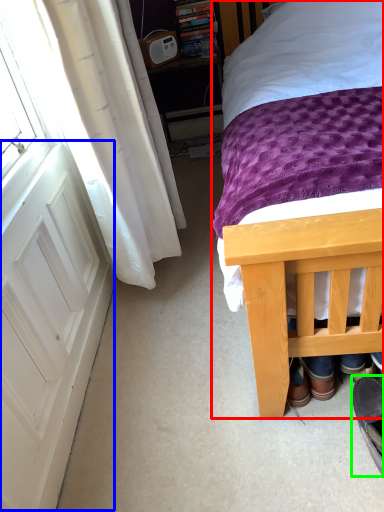
Question: Estimate the real-world distances between objects in this image. Which object is farther from bed (highlighted by a red box), screen door (highlighted by a blue box) or footwear (highlighted by a green box)?

Choices:
 (A) screen door
 (B) footwear

Answer: (B)